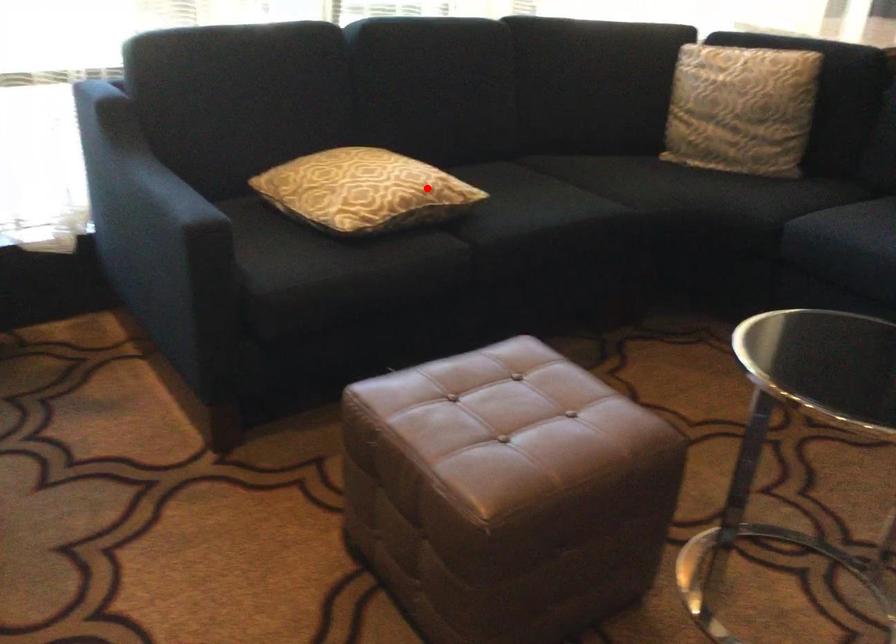
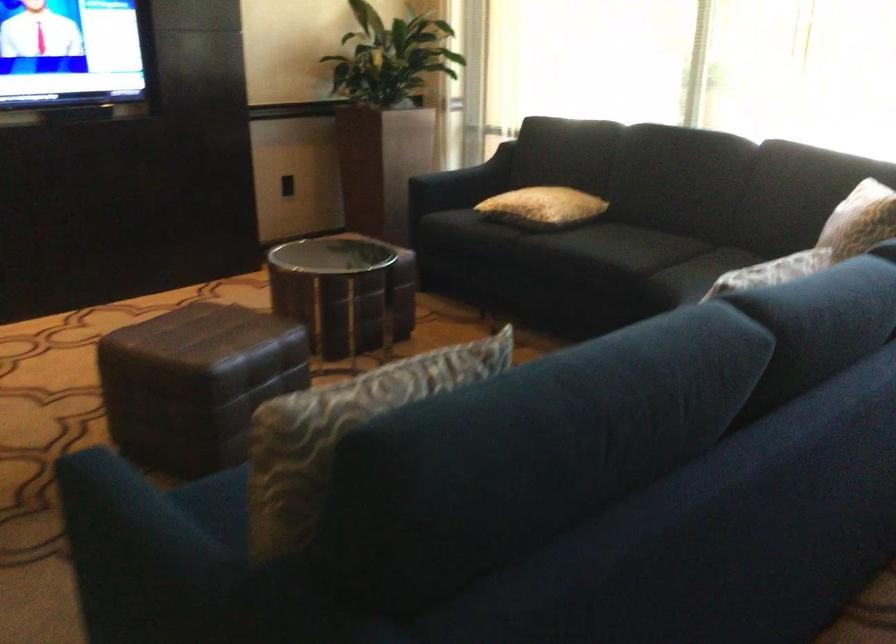
Question: A red point is marked in image1. In image2, is the corresponding 3D point closer to the camera or farther? Reply with the corresponding letter.

Choices:
 (A) The corresponding 3D point is closer.
 (B) The corresponding 3D point is farther.

Answer: (B)